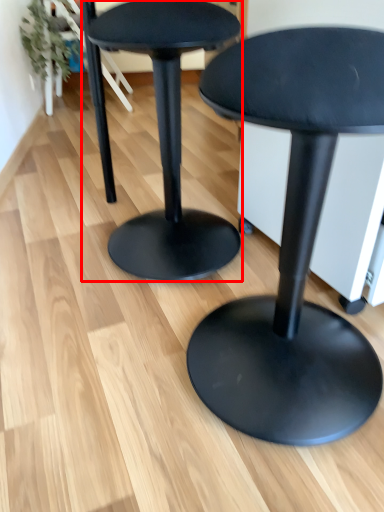
Question: From the image's perspective, where is stool (annotated by the red box) located in relation to stool in the image?

Choices:
 (A) below
 (B) above

Answer: (B)